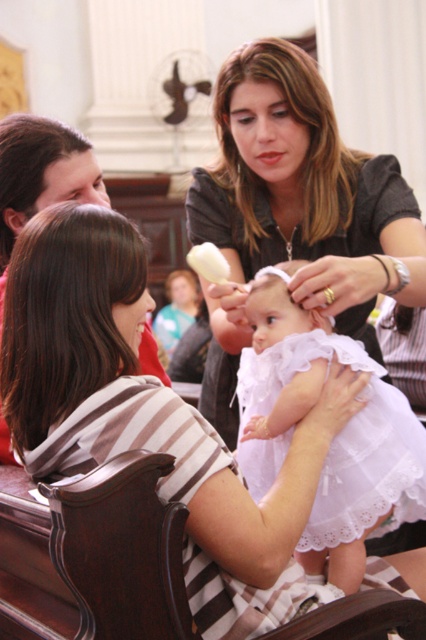
What do you see at coordinates (294, 209) in the screenshot? I see `matte black shirt at upper center` at bounding box center [294, 209].

The image size is (426, 640). I want to click on matte black shirt at upper center, so click(x=294, y=209).

At what (x,y) coordinates should I click in order to perform the action: click on matte black shirt at upper center. Please return your answer as a coordinate pair (x, y). The width and height of the screenshot is (426, 640). Looking at the image, I should click on (294, 209).

Which is more to the left, matte black shirt at upper center or white lace dress at center?

matte black shirt at upper center

Can you confirm if matte black shirt at upper center is smaller than white lace dress at center?

No, matte black shirt at upper center is not smaller than white lace dress at center.

Measure the distance between matte black shirt at upper center and camera.

matte black shirt at upper center is 35.58 feet from camera.

At what (x,y) coordinates should I click in order to perform the action: click on matte black shirt at upper center. Please return your answer as a coordinate pair (x, y). The image size is (426, 640). Looking at the image, I should click on (294, 209).

Does white lace dress at center have a smaller size compared to brown striped shirt at lower left?

No.

The width and height of the screenshot is (426, 640). Find the location of `white lace dress at center`. white lace dress at center is located at coordinates (333, 440).